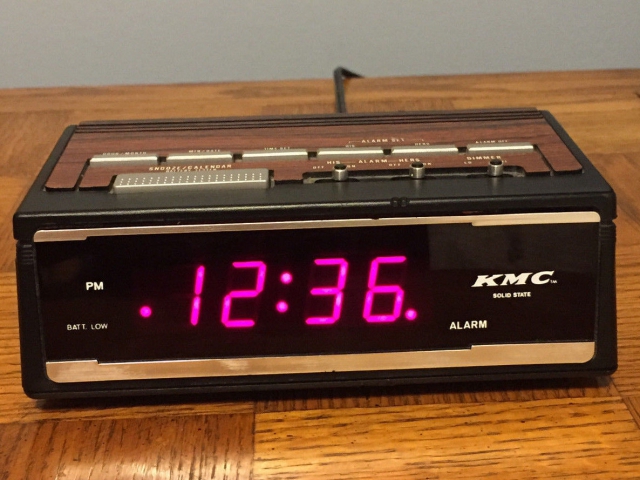
This screenshot has height=480, width=640. What are the coordinates of `alarm` in the screenshot? It's located at (475, 321).